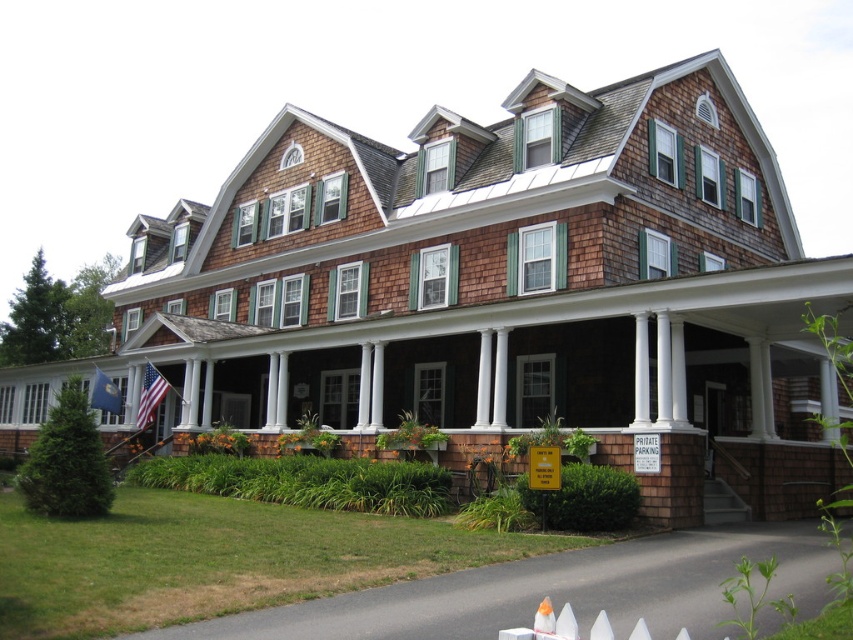
Question: Does american flag at left appear on the right side of blue fabric flag at lower left?

Choices:
 (A) no
 (B) yes

Answer: (B)

Question: Does american flag at left appear under blue fabric flag at lower left?

Choices:
 (A) no
 (B) yes

Answer: (A)

Question: Does american flag at left have a lesser width compared to blue fabric flag at lower left?

Choices:
 (A) yes
 (B) no

Answer: (A)

Question: Among these objects, which one is nearest to the camera?

Choices:
 (A) blue fabric flag at lower left
 (B) american flag at left

Answer: (B)